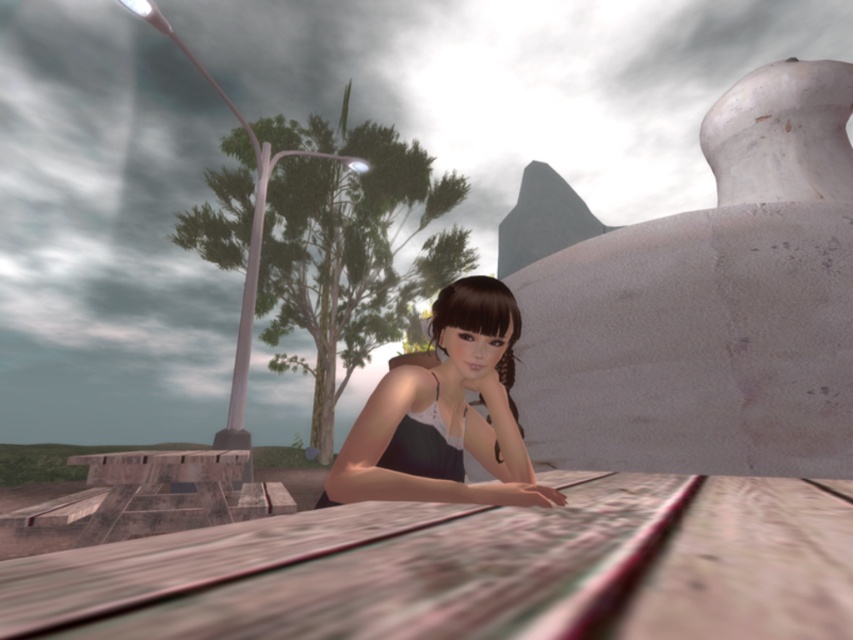
You are planning to set up a small gathering at the location shown in the image. Given the space occupied by the wooden picnic table at center and the matte black dress at center, which object takes up more area in the scene?

The matte black dress at center takes up more area in the scene than the wooden picnic table at center, as the wooden picnic table at center occupies less space than matte black dress at center.

You are standing in the scene and need to locate the wooden picnic table at center. What are its coordinates?

The wooden picnic table at center is located at coordinates (x=468, y=570).